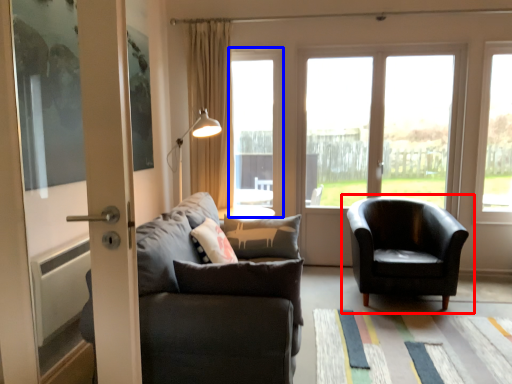
Question: Which of the following is the closest to the observer, chair (highlighted by a red box) or window (highlighted by a blue box)?

Choices:
 (A) chair
 (B) window

Answer: (A)